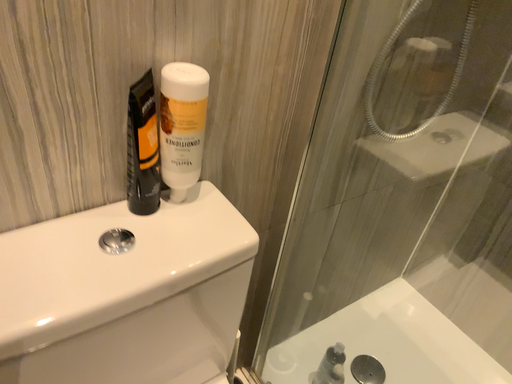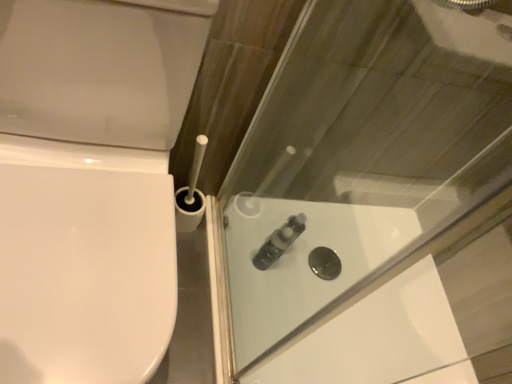
Question: How did the camera likely rotate when shooting the video?

Choices:
 (A) rotated downward
 (B) rotated upward

Answer: (A)